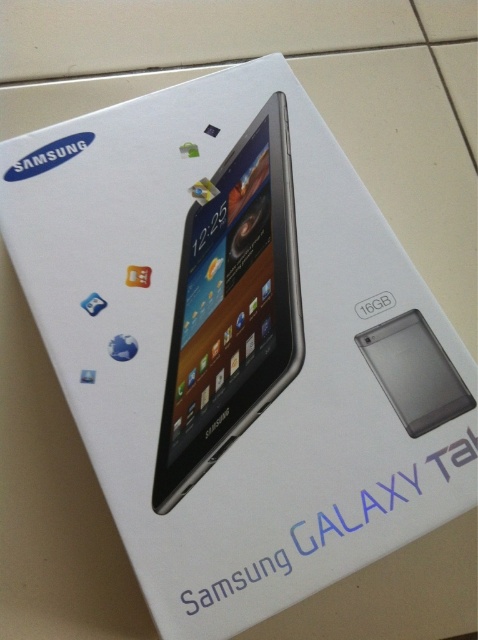
Between silver metallic tablet at center and transparent plastic smartphone at center, which one appears on the left side from the viewer's perspective?

Positioned to the left is silver metallic tablet at center.

In the scene shown: Between silver metallic tablet at center and transparent plastic smartphone at center, which one appears on the right side from the viewer's perspective?

Positioned to the right is transparent plastic smartphone at center.

Which is behind, point (184, 419) or point (403, 369)?

The point (184, 419) is behind.

Find the location of `silver metallic tablet at center`. silver metallic tablet at center is located at coordinates (231, 307).